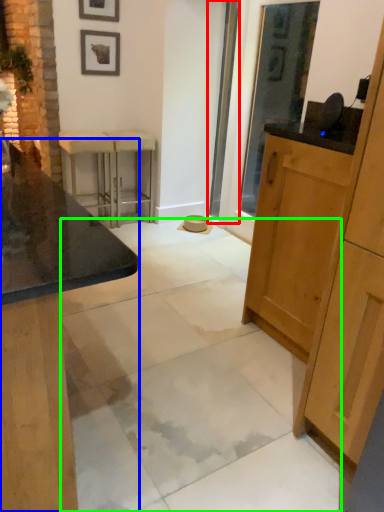
Question: Based on their relative distances, which object is farther from screen door (highlighted by a red box)? Choose from cabinetry (highlighted by a blue box) and concrete (highlighted by a green box).

Choices:
 (A) cabinetry
 (B) concrete

Answer: (A)